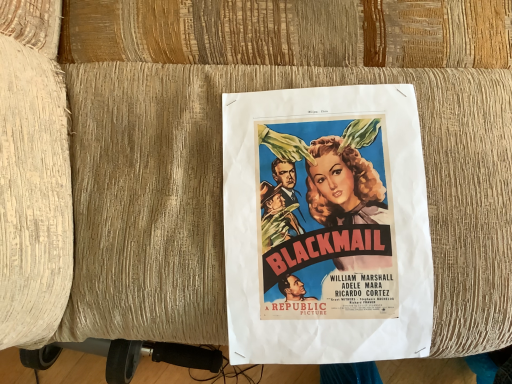
This screenshot has height=384, width=512. I want to click on free space above matte paper poster at center (from a real-world perspective), so click(x=331, y=220).